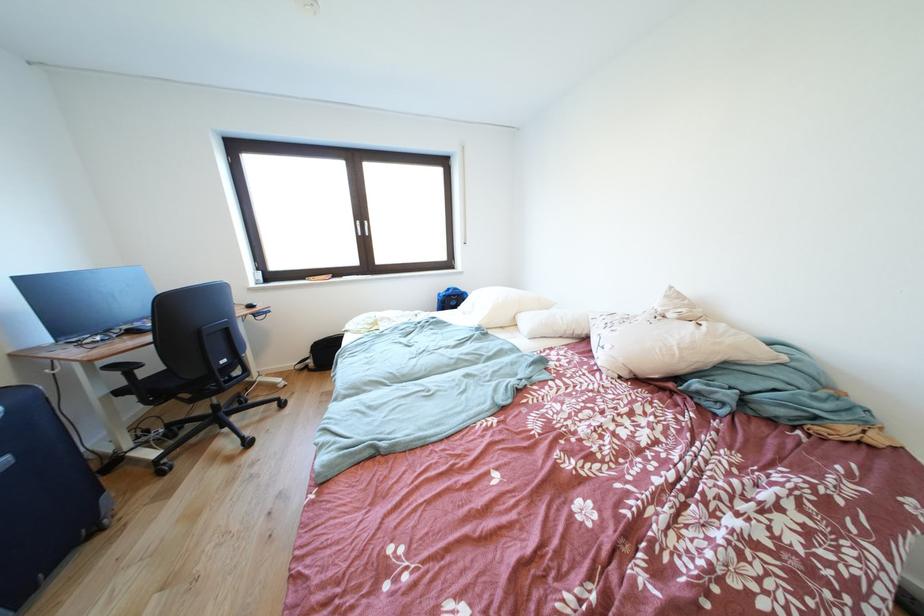
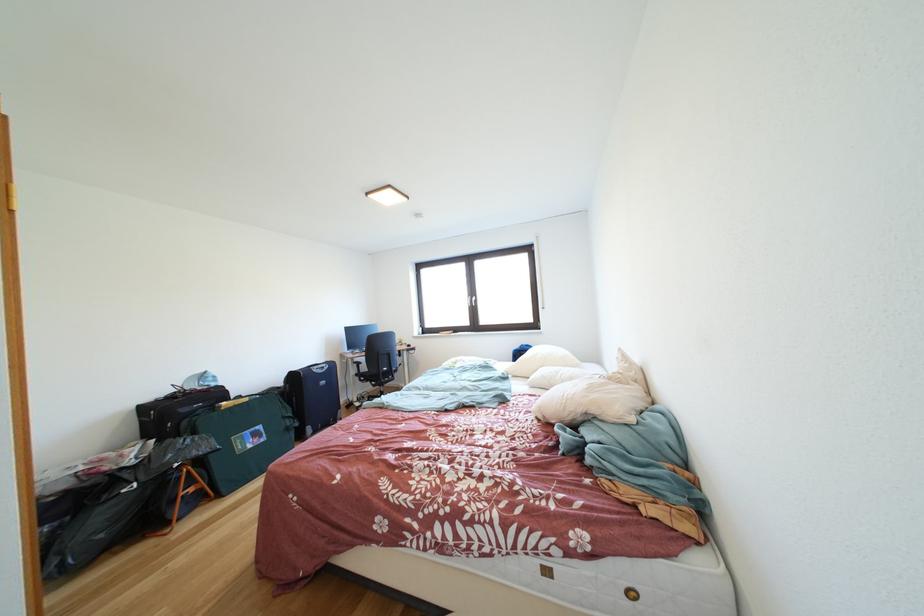
The point at (199, 406) is marked in the first image. Where is the corresponding point in the second image?

(383, 391)